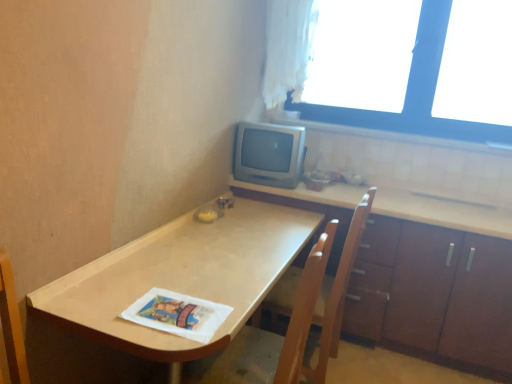
Question: Relative to wooden chair at center, is white sheer curtain at upper right in front or behind?

Choices:
 (A) behind
 (B) front

Answer: (A)

Question: From a real-world perspective, relative to wooden chair at center, is white sheer curtain at upper right vertically above or below?

Choices:
 (A) above
 (B) below

Answer: (A)

Question: Considering the real-world distances, which object is closest to the satin silver monitor at upper right?

Choices:
 (A) white sheer curtain at upper right
 (B) white paper magazine at lower center
 (C) wooden chair at center
 (D) matte wood table at center
 (E) wooden swivel chair at center

Answer: (A)

Question: Considering the real-world distances, which object is farthest from the white sheer curtain at upper right?

Choices:
 (A) brown wood cabinet at lower right
 (B) white paper magazine at lower center
 (C) satin silver monitor at upper right
 (D) wooden swivel chair at center
 (E) transparent glass window at upper right

Answer: (B)